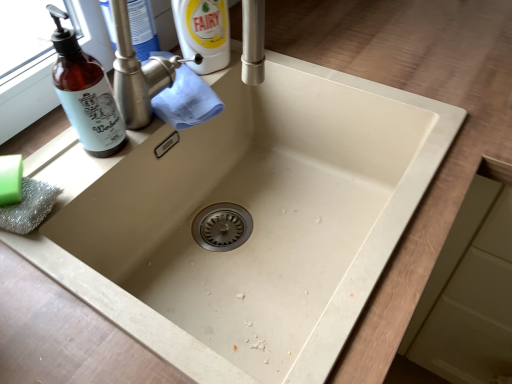
This screenshot has width=512, height=384. Describe the element at coordinates (85, 93) in the screenshot. I see `brown glass bottle at left` at that location.

I want to click on green matte soap at lower left, so click(11, 179).

From the image's perspective, which is below, brushed metal tap at upper center or green matte soap at lower left?

green matte soap at lower left, from the image's perspective.

Can you tell me how much brushed metal tap at upper center and green matte soap at lower left differ in facing direction?

The angular difference between brushed metal tap at upper center and green matte soap at lower left is 23.7 degrees.

Could you tell me if brushed metal tap at upper center is turned towards green matte soap at lower left?

No, brushed metal tap at upper center is not turned towards green matte soap at lower left.

Where is `tap that appears behind the brown glass bottle at left`? tap that appears behind the brown glass bottle at left is located at coordinates (139, 72).

From the image's perspective, is brown glass bottle at left over brushed metal tap at upper center?

No, from the image's perspective, brown glass bottle at left is not on top of brushed metal tap at upper center.

Considering the sizes of brown glass bottle at left and brushed metal tap at upper center in the image, is brown glass bottle at left taller or shorter than brushed metal tap at upper center?

Clearly, brown glass bottle at left is taller compared to brushed metal tap at upper center.

Considering the relative positions of brown glass bottle at left and brushed metal tap at upper center in the image provided, is brown glass bottle at left to the left of brushed metal tap at upper center from the viewer's perspective?

Indeed, brown glass bottle at left is positioned on the left side of brushed metal tap at upper center.

Would you consider green matte soap at lower left to be distant from brown glass bottle at left?

No, green matte soap at lower left is in close proximity to brown glass bottle at left.

From a real-world perspective, relative to brown glass bottle at left, is green matte soap at lower left vertically above or below?

From a real-world perspective, green matte soap at lower left is physically below brown glass bottle at left.

In the scene shown: Is green matte soap at lower left to the left or to the right of brown glass bottle at left in the image?

Clearly, green matte soap at lower left is on the left of brown glass bottle at left in the image.

You are a GUI agent. You are given a task and a screenshot of the screen. Output one action in this format:
    pyautogui.click(x=<x>, y=<y>)
    Task: Click on the soap that appears below the brown glass bottle at left (from the image's perspective)
    
    Given the screenshot: What is the action you would take?
    pyautogui.click(x=11, y=179)

Considering the sizes of green matte soap at lower left and brushed metal tap at upper center in the image, is green matte soap at lower left bigger or smaller than brushed metal tap at upper center?

green matte soap at lower left is smaller than brushed metal tap at upper center.

Which object is more forward, green matte soap at lower left or brushed metal tap at upper center?

green matte soap at lower left is closer to the camera.

Is point (0, 172) positioned in front of point (150, 112)?

Yes, point (0, 172) is closer to viewer.

Is green matte soap at lower left not close to brushed metal tap at upper center?

Actually, green matte soap at lower left and brushed metal tap at upper center are a little close together.

From a real-world perspective, between brown glass bottle at left and green matte soap at lower left, who is vertically lower?

green matte soap at lower left, from a real-world perspective.

I want to click on soap on the left side of brown glass bottle at left, so click(11, 179).

From the image's perspective, is brown glass bottle at left above green matte soap at lower left?

Yes, from the image's perspective, brown glass bottle at left is above green matte soap at lower left.

Can you confirm if brown glass bottle at left is thinner than green matte soap at lower left?

Indeed, brown glass bottle at left has a lesser width compared to green matte soap at lower left.

Considering the relative sizes of brushed metal tap at upper center and brown glass bottle at left in the image provided, is brushed metal tap at upper center wider than brown glass bottle at left?

Yes.

Is brushed metal tap at upper center inside or outside of brown glass bottle at left?

brushed metal tap at upper center is outside brown glass bottle at left.

Consider the image. Which point is more forward, (132, 111) or (82, 85)?

The point (82, 85) is closer.

Is brushed metal tap at upper center turned away from brown glass bottle at left?

No, brushed metal tap at upper center's orientation is not away from brown glass bottle at left.

In the image, there is a brushed metal tap at upper center. Where is `soap below it (from the image's perspective)`? Image resolution: width=512 pixels, height=384 pixels. soap below it (from the image's perspective) is located at coordinates (11, 179).

The height and width of the screenshot is (384, 512). What are the coordinates of `tap below the brown glass bottle at left (from a real-world perspective)` in the screenshot? It's located at (139, 72).

Considering their positions, is brown glass bottle at left positioned further to green matte soap at lower left than brushed metal tap at upper center?

Among the two, brushed metal tap at upper center is located further to green matte soap at lower left.

Considering their positions, is green matte soap at lower left positioned further to brown glass bottle at left than brushed metal tap at upper center?

Based on the image, green matte soap at lower left appears to be further to brown glass bottle at left.

Considering their positions, is brushed metal tap at upper center positioned further to brown glass bottle at left than green matte soap at lower left?

green matte soap at lower left lies further to brown glass bottle at left than the other object.

Estimate the real-world distances between objects in this image. Which object is closer to green matte soap at lower left, brushed metal tap at upper center or brown glass bottle at left?

brown glass bottle at left is positioned closer to the anchor green matte soap at lower left.

Estimate the real-world distances between objects in this image. Which object is further from brushed metal tap at upper center, green matte soap at lower left or brown glass bottle at left?

green matte soap at lower left lies further to brushed metal tap at upper center than the other object.

Looking at this image, estimate the real-world distances between objects in this image. Which object is closer to brushed metal tap at upper center, brown glass bottle at left or green matte soap at lower left?

Based on the image, brown glass bottle at left appears to be nearer to brushed metal tap at upper center.

At what (x,y) coordinates should I click in order to perform the action: click on soap between brown glass bottle at left and brushed metal tap at upper center from front to back. Please return your answer as a coordinate pair (x, y). This screenshot has height=384, width=512. Looking at the image, I should click on (11, 179).